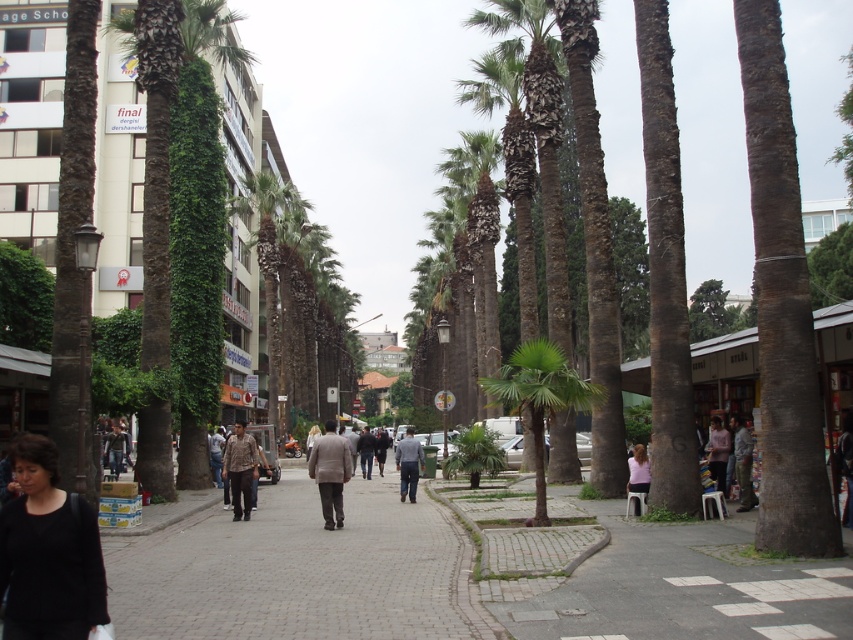
Does black matte shirt at lower left come behind green leafy palm tree at center?

No, it is in front of green leafy palm tree at center.

Is point (27, 609) positioned in front of point (537, 465)?

That is True.

Identify the location of black matte shirt at lower left. Image resolution: width=853 pixels, height=640 pixels. (48, 552).

Between green leafy palm tree at center and light brown fabric jacket at center, which one appears on the right side from the viewer's perspective?

Positioned to the right is green leafy palm tree at center.

Does green leafy palm tree at center appear over light brown fabric jacket at center?

Yes, green leafy palm tree at center is above light brown fabric jacket at center.

Which is in front, point (537, 449) or point (328, 476)?

Point (328, 476) is more forward.

You are a GUI agent. You are given a task and a screenshot of the screen. Output one action in this format:
    pyautogui.click(x=<x>, y=<y>)
    Task: Click on the green leafy palm tree at center
    
    Given the screenshot: What is the action you would take?
    pyautogui.click(x=538, y=397)

Locate an element on the screen. The image size is (853, 640). black matte shirt at lower left is located at coordinates (48, 552).

In the scene shown: Can you confirm if black matte shirt at lower left is positioned to the right of light brown fabric jacket at center?

Indeed, black matte shirt at lower left is positioned on the right side of light brown fabric jacket at center.

Does point (51, 572) come in front of point (326, 476)?

That is True.

Identify the location of black matte shirt at lower left. (48, 552).